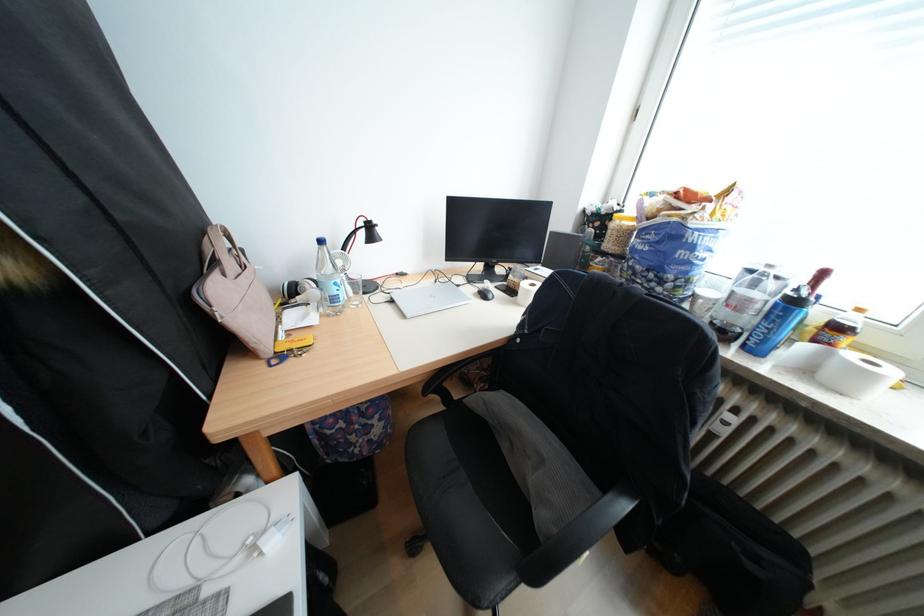
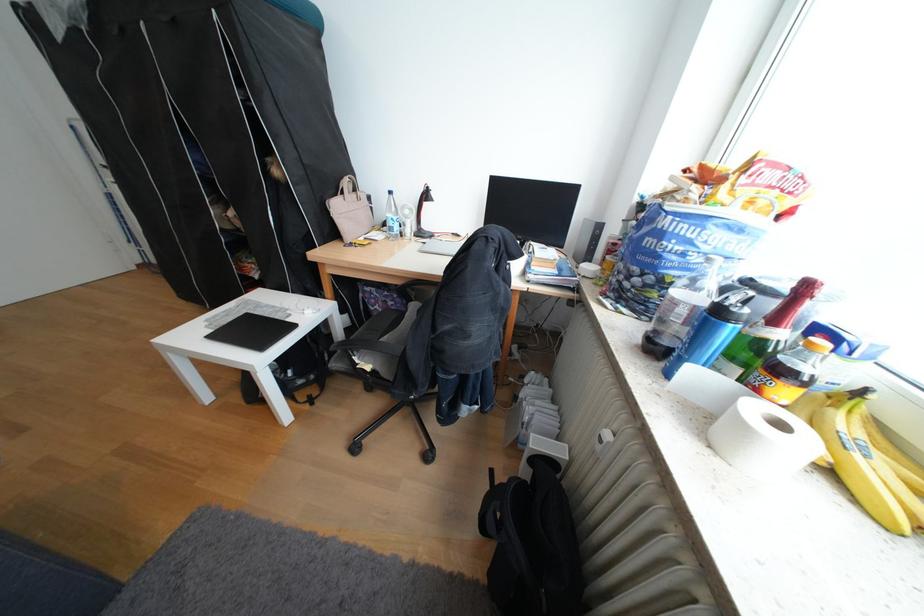
Find the pixel in the second image that matches [460,199] in the first image.

(504, 177)